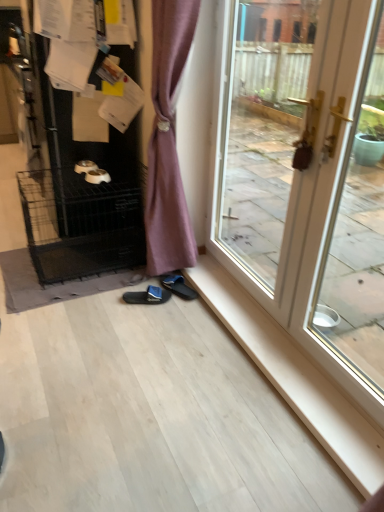
Question: Does black wire dog crate at left have a larger size compared to black fabric slipper at lower center, which is the first footwear in right-to-left order?

Choices:
 (A) no
 (B) yes

Answer: (B)

Question: Considering the relative positions of black wire dog crate at left and black fabric slipper at lower center, which appears as the 2th footwear when viewed from the left, in the image provided, is black wire dog crate at left to the left of black fabric slipper at lower center, which appears as the 2th footwear when viewed from the left, from the viewer's perspective?

Choices:
 (A) yes
 (B) no

Answer: (A)

Question: Is black wire dog crate at left at the right side of black fabric slipper at lower center, which is the first footwear in right-to-left order?

Choices:
 (A) yes
 (B) no

Answer: (B)

Question: From the image's perspective, is black wire dog crate at left below black fabric slipper at lower center, which is the first footwear in right-to-left order?

Choices:
 (A) yes
 (B) no

Answer: (B)

Question: Considering the relative positions of black wire dog crate at left and black fabric slipper at lower center, which appears as the 2th footwear when viewed from the left, in the image provided, is black wire dog crate at left behind black fabric slipper at lower center, which appears as the 2th footwear when viewed from the left,?

Choices:
 (A) yes
 (B) no

Answer: (B)

Question: Is black fabric slipper at lower center, which is the first footwear in right-to-left order, a part of black wire dog crate at left?

Choices:
 (A) yes
 (B) no

Answer: (B)

Question: Could you tell me if white glossy screen door at right is turned towards white glossy door at right?

Choices:
 (A) yes
 (B) no

Answer: (B)

Question: Is white glossy screen door at right shorter than white glossy door at right?

Choices:
 (A) no
 (B) yes

Answer: (B)

Question: Are white glossy screen door at right and white glossy door at right far apart?

Choices:
 (A) yes
 (B) no

Answer: (B)

Question: Is white glossy door at right inside white glossy screen door at right?

Choices:
 (A) yes
 (B) no

Answer: (B)

Question: Considering the relative positions of white glossy screen door at right and white glossy door at right in the image provided, is white glossy screen door at right to the left of white glossy door at right from the viewer's perspective?

Choices:
 (A) no
 (B) yes

Answer: (A)

Question: Is white glossy screen door at right smaller than white glossy door at right?

Choices:
 (A) no
 (B) yes

Answer: (B)

Question: Is black wire dog crate at left oriented away from black wire cage at left?

Choices:
 (A) no
 (B) yes

Answer: (A)